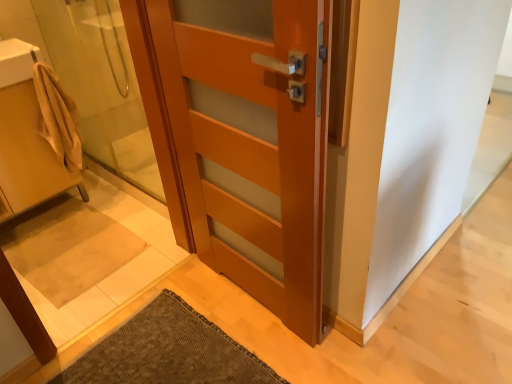
Question: Is beige fabric towel at left, which ranks as the first sink in bottom-to-top order, in contact with matte wood door at center?

Choices:
 (A) no
 (B) yes

Answer: (A)

Question: Does beige fabric towel at left, the second sink positioned from the top, appear on the right side of matte wood door at center?

Choices:
 (A) yes
 (B) no

Answer: (B)

Question: Can you confirm if beige fabric towel at left, which ranks as the first sink in bottom-to-top order, is smaller than matte wood door at center?

Choices:
 (A) yes
 (B) no

Answer: (B)

Question: Considering the relative sizes of beige fabric towel at left, which ranks as the first sink in bottom-to-top order, and matte wood door at center in the image provided, is beige fabric towel at left, which ranks as the first sink in bottom-to-top order, bigger than matte wood door at center?

Choices:
 (A) no
 (B) yes

Answer: (B)

Question: Considering the relative sizes of beige fabric towel at left, which ranks as the first sink in bottom-to-top order, and matte wood door at center in the image provided, is beige fabric towel at left, which ranks as the first sink in bottom-to-top order, thinner than matte wood door at center?

Choices:
 (A) no
 (B) yes

Answer: (A)

Question: Is beige fabric towel at left, which ranks as the first sink in bottom-to-top order, completely or partially outside of matte wood door at center?

Choices:
 (A) no
 (B) yes

Answer: (B)

Question: Is beige fabric towel at left, which ranks as the first sink in bottom-to-top order, taller than translucent glass shower door at left?

Choices:
 (A) yes
 (B) no

Answer: (B)

Question: Is beige fabric towel at left, which ranks as the first sink in bottom-to-top order, wider than translucent glass shower door at left?

Choices:
 (A) yes
 (B) no

Answer: (A)

Question: Does beige fabric towel at left, which ranks as the first sink in bottom-to-top order, lie behind translucent glass shower door at left?

Choices:
 (A) yes
 (B) no

Answer: (A)

Question: Is beige fabric towel at left, the second sink positioned from the top, next to translucent glass shower door at left and touching it?

Choices:
 (A) no
 (B) yes

Answer: (A)

Question: Is beige fabric towel at left, which ranks as the first sink in bottom-to-top order, closer to camera compared to translucent glass shower door at left?

Choices:
 (A) yes
 (B) no

Answer: (B)

Question: Can translucent glass shower door at left be found inside beige fabric towel at left, which ranks as the first sink in bottom-to-top order?

Choices:
 (A) no
 (B) yes

Answer: (A)

Question: Is white glossy sink at upper left, which ranks as the second sink in bottom-to-top order, positioned with its back to beige fabric bath mat at lower left?

Choices:
 (A) no
 (B) yes

Answer: (A)